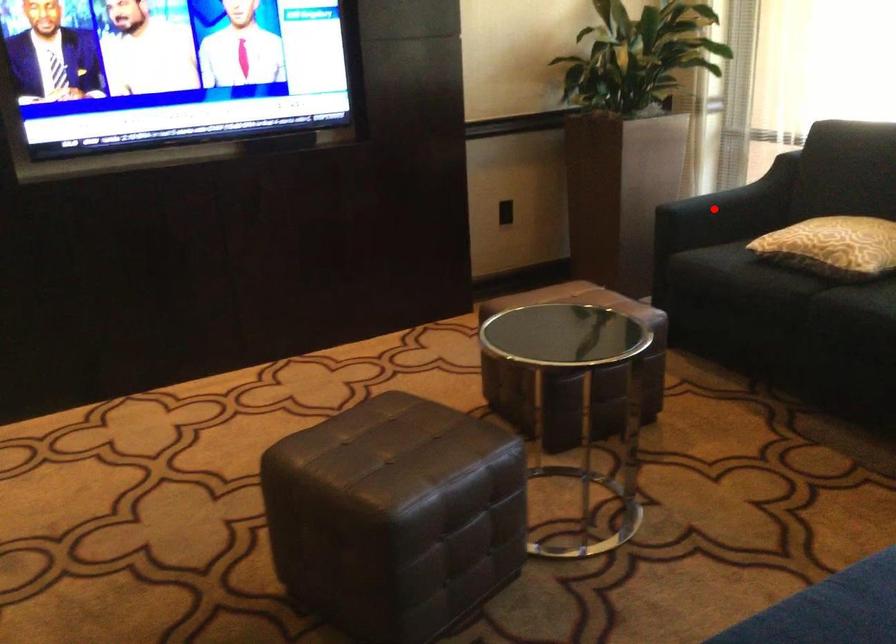
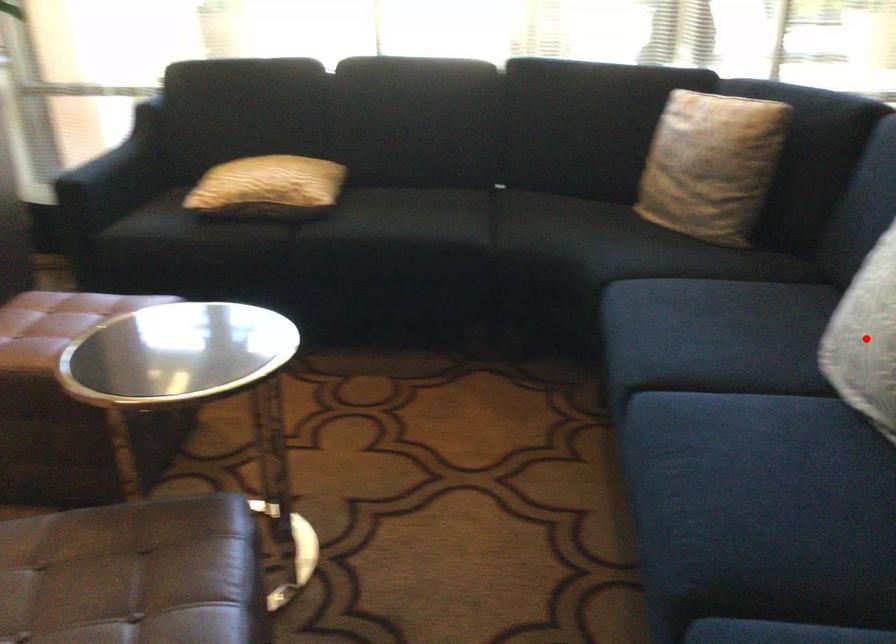
I am providing you with two images of the same scene from different viewpoints. A red point is marked on the first image and another point is marked on the second image. Is the marked point in image1 the same physical position as the marked point in image2?

No